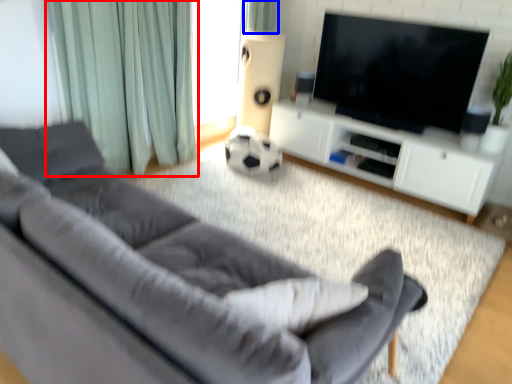
Question: Which object appears farthest to the camera in this image, curtain (highlighted by a red box) or curtain (highlighted by a blue box)?

Choices:
 (A) curtain
 (B) curtain

Answer: (B)